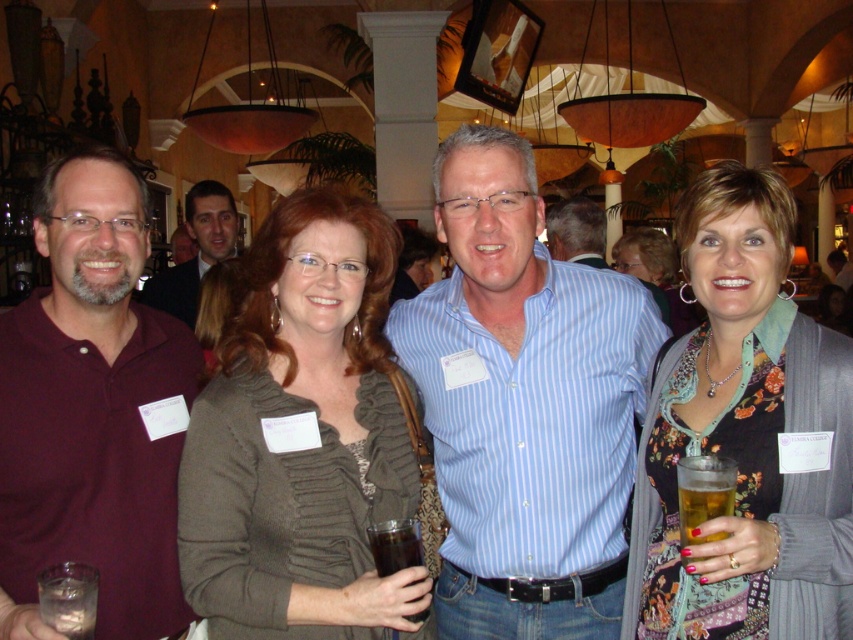
Question: Which point is farther to the camera?

Choices:
 (A) dark suit at center
 (B) knitted green sweater at center

Answer: (A)

Question: Estimate the real-world distances between objects in this image. Which object is closer to the clear glass at lower left?

Choices:
 (A) blue striped shirt at center
 (B) golden amber liquid at lower right

Answer: (B)

Question: Does floral fabric dress at center lie in front of clear glass at lower left?

Choices:
 (A) yes
 (B) no

Answer: (B)

Question: Does dark suit at center have a smaller size compared to dark brown liquid at center?

Choices:
 (A) no
 (B) yes

Answer: (A)

Question: Can you confirm if knitted green sweater at center is positioned above floral print dress at center?

Choices:
 (A) no
 (B) yes

Answer: (A)

Question: Which point is closer to the camera?

Choices:
 (A) (669, 296)
 (B) (224, 460)
 (C) (96, 550)

Answer: (B)